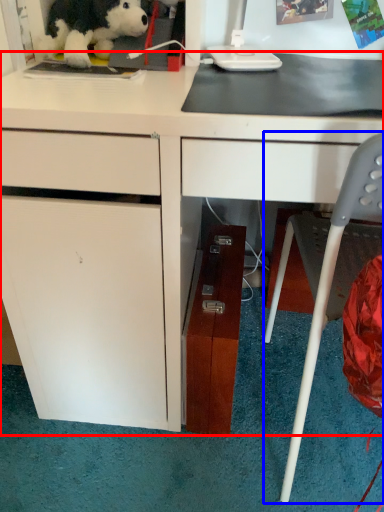
Question: Which of the following is the farthest to the observer, desk (highlighted by a red box) or chair (highlighted by a blue box)?

Choices:
 (A) desk
 (B) chair

Answer: (A)